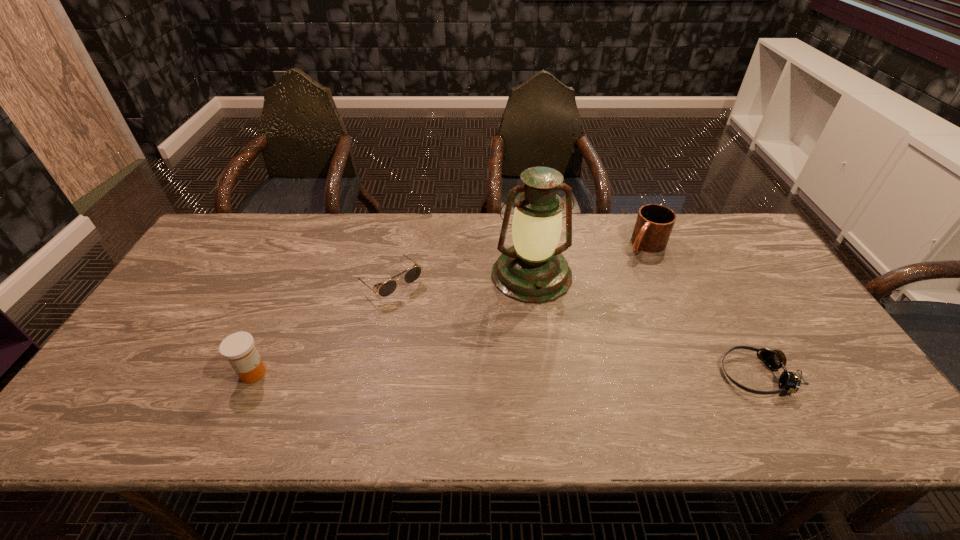
Locate an element on the screen. The width and height of the screenshot is (960, 540). vacant space on the desktop that is between the medicine and the goggles and is positioned on the front lenses of the second object from left to right is located at coordinates (489, 374).

This screenshot has width=960, height=540. I want to click on vacant space on the desktop that is between the leftmost object and the shortest object and is positioned with the light compartment facing forward on the third object from right to left, so click(x=558, y=374).

Where is `vacant spot on the desktop that is between the leftmost object and the shortest object and is positioned on the side of the mug with the handle`? Image resolution: width=960 pixels, height=540 pixels. vacant spot on the desktop that is between the leftmost object and the shortest object and is positioned on the side of the mug with the handle is located at coordinates (516, 374).